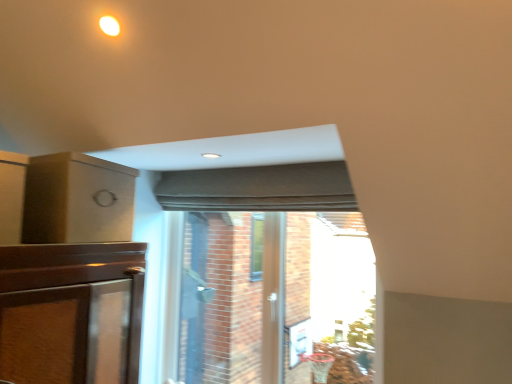
Measure the distance between point (297,197) and camera.

The depth of point (297,197) is 2.02 meters.

Find the location of a particular element. matte gray curtain at center is located at coordinates (259, 188).

I want to click on transparent glass door at center, so click(272, 274).

How many degrees apart are the facing directions of matte brown box at upper left and matte gray curtain at center?

94.2 degrees separate the facing orientations of matte brown box at upper left and matte gray curtain at center.

Is matte brown box at upper left smaller than matte gray curtain at center?

Actually, matte brown box at upper left might be larger than matte gray curtain at center.

Is matte gray curtain at center inside matte brown box at upper left?

No, matte gray curtain at center is not surrounded by matte brown box at upper left.

Considering the sizes of objects matte brown box at upper left and matte gray curtain at center in the image provided, who is taller, matte brown box at upper left or matte gray curtain at center?

matte brown box at upper left.

Based on the photo, considering the relative positions of matte gray curtain at center and transparent glass door at center in the image provided, is matte gray curtain at center to the right of transparent glass door at center from the viewer's perspective?

No.

From a real-world perspective, which object stands above the other?

In real-world perspective, matte gray curtain at center is above.

Does matte gray curtain at center have a lesser height compared to transparent glass door at center?

Indeed, matte gray curtain at center has a lesser height compared to transparent glass door at center.

Looking at this image, is the position of matte gray curtain at center more distant than that of transparent glass door at center?

Yes, matte gray curtain at center is further from the viewer.

Where is `bay window that is on the right side of matte brown box at upper left`? This screenshot has width=512, height=384. bay window that is on the right side of matte brown box at upper left is located at coordinates [272, 274].

Is matte brown box at upper left at the right side of transparent glass door at center?

No.

Are matte brown box at upper left and transparent glass door at center located far from each other?

No.

Which of these two, matte brown box at upper left or transparent glass door at center, stands shorter?

matte brown box at upper left.

Who is bigger, matte gray curtain at center or matte brown box at upper left?

matte brown box at upper left.

From the image's perspective, is matte gray curtain at center above or below matte brown box at upper left?

matte gray curtain at center is above matte brown box at upper left.

Considering the relative positions of matte gray curtain at center and matte brown box at upper left in the image provided, is matte gray curtain at center in front of matte brown box at upper left?

No, it is behind matte brown box at upper left.

Consider the image. How distant is matte gray curtain at center from matte brown box at upper left?

The distance of matte gray curtain at center from matte brown box at upper left is 29.19 inches.

Is transparent glass door at center wider than matte brown box at upper left?

No.

Is there a large distance between transparent glass door at center and matte brown box at upper left?

No, transparent glass door at center is in close proximity to matte brown box at upper left.

From the image's perspective, is transparent glass door at center above or below matte brown box at upper left?

transparent glass door at center is situated lower than matte brown box at upper left in the image.

Find the location of a particular element. bay window that appears in front of the matte gray curtain at center is located at coordinates (272, 274).

Is transparent glass door at center facing away from matte gray curtain at center?

transparent glass door at center is not turned away from matte gray curtain at center.

Which is in front, point (234, 212) or point (334, 168)?

Positioned in front is point (334, 168).

From a real-world perspective, relative to matte gray curtain at center, is transparent glass door at center vertically above or below?

Clearly, from a real-world perspective, transparent glass door at center is below matte gray curtain at center.

Identify the location of curtain behind the matte brown box at upper left. Image resolution: width=512 pixels, height=384 pixels. (259, 188).

The height and width of the screenshot is (384, 512). I want to click on bay window below the matte gray curtain at center (from the image's perspective), so click(x=272, y=274).

Considering their positions, is matte gray curtain at center positioned further to transparent glass door at center than matte brown box at upper left?

matte brown box at upper left.

Estimate the real-world distances between objects in this image. Which object is closer to transparent glass door at center, matte brown box at upper left or matte gray curtain at center?

A: matte gray curtain at center lies closer to transparent glass door at center than the other object.

Estimate the real-world distances between objects in this image. Which object is further from matte gray curtain at center, transparent glass door at center or matte brown box at upper left?

Among the two, matte brown box at upper left is located further to matte gray curtain at center.

Considering their positions, is matte gray curtain at center positioned closer to matte brown box at upper left than transparent glass door at center?

matte gray curtain at center is positioned closer to the anchor matte brown box at upper left.

Considering their positions, is transparent glass door at center positioned closer to matte brown box at upper left than matte gray curtain at center?

Based on the image, matte gray curtain at center appears to be nearer to matte brown box at upper left.

Which object lies nearer to the anchor point matte gray curtain at center, matte brown box at upper left or transparent glass door at center?

Among the two, transparent glass door at center is located nearer to matte gray curtain at center.

Where is `curtain between matte brown box at upper left and transparent glass door at center`? curtain between matte brown box at upper left and transparent glass door at center is located at coordinates (259, 188).